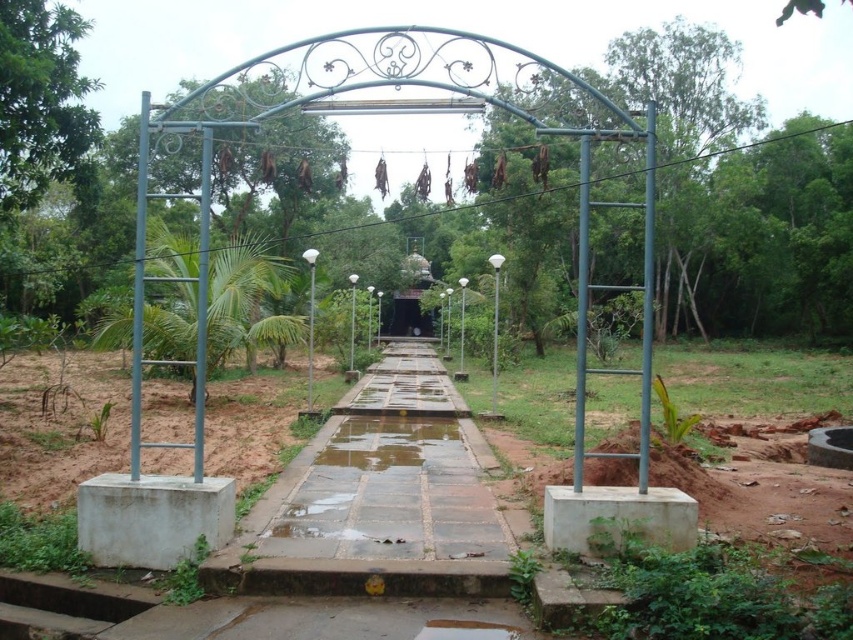
Is wet concrete path at center taller than glossy concrete puddle at center?

Yes.

Between wet concrete path at center and glossy concrete puddle at center, which one appears on the left side from the viewer's perspective?

glossy concrete puddle at center is more to the left.

Is point (450, 557) behind point (340, 452)?

No, (450, 557) is in front of (340, 452).

The image size is (853, 640). I want to click on wet concrete path at center, so click(387, 474).